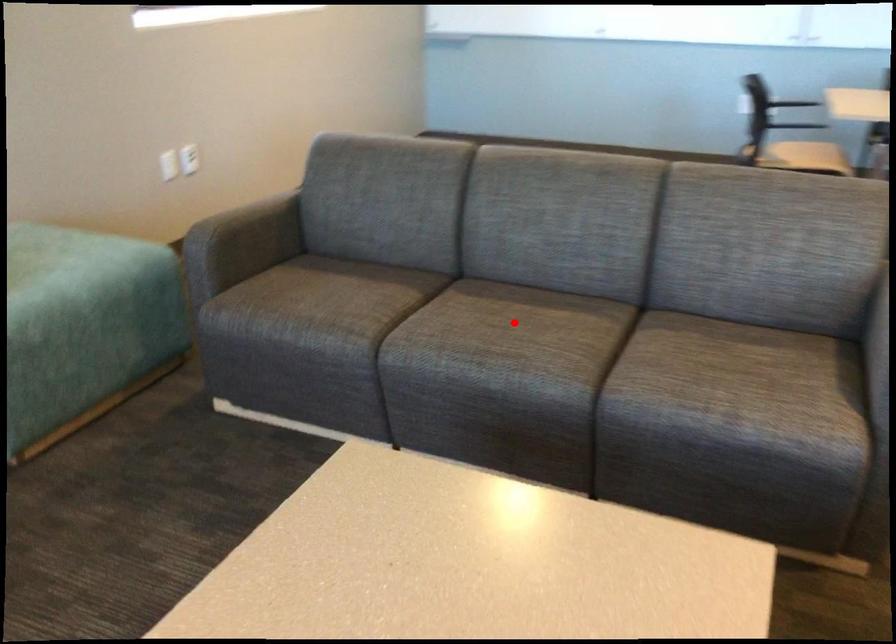
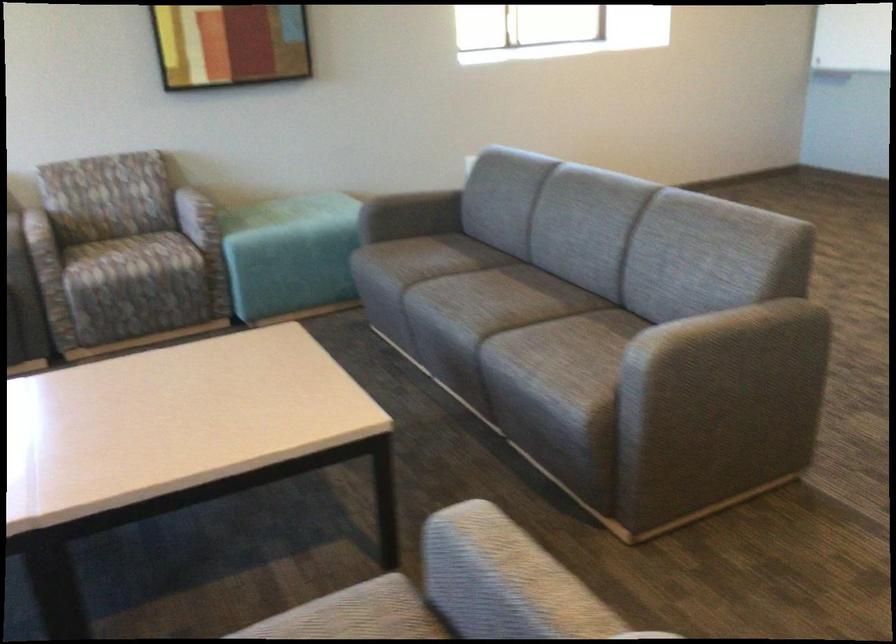
In the second image, find the point that corresponds to the highlighted location in the first image.

(503, 297)